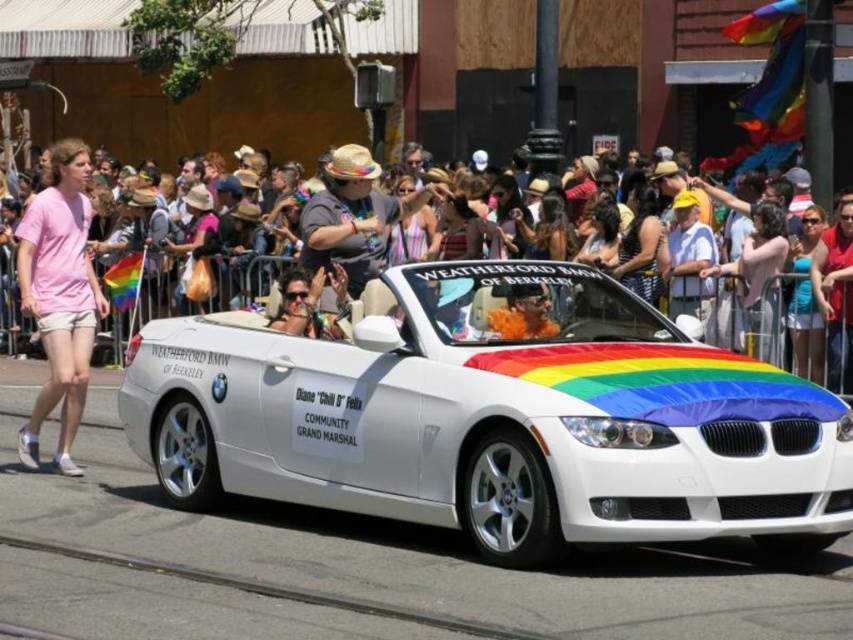
Which is behind, point (80, 198) or point (492, 326)?

Positioned behind is point (80, 198).

Is pink cotton t-shirt at left positioned at the back of orange fuzzy hat at center?

Yes, pink cotton t-shirt at left is behind orange fuzzy hat at center.

Locate an element on the screen. This screenshot has width=853, height=640. pink cotton t-shirt at left is located at coordinates (59, 296).

The height and width of the screenshot is (640, 853). I want to click on pink cotton t-shirt at left, so click(x=59, y=296).

Between pink cotton t-shirt at left and rainbow fabric crowd at center, which one has less height?

rainbow fabric crowd at center

Which is in front, point (76, 392) or point (109, 257)?

Point (76, 392) is more forward.

Is point (73, 200) farther from camera compared to point (0, 332)?

That is False.

This screenshot has height=640, width=853. Identify the location of pink cotton t-shirt at left. (59, 296).

Does rainbow fabric crowd at center appear under orange fuzzy hat at center?

No, rainbow fabric crowd at center is not below orange fuzzy hat at center.

Between point (45, 168) and point (544, 296), which one is positioned in front?

Point (544, 296) is in front.

Who is more forward, (99, 280) or (538, 296)?

Positioned in front is point (538, 296).

Where is `rainbow fabric crowd at center`? This screenshot has height=640, width=853. rainbow fabric crowd at center is located at coordinates (171, 289).